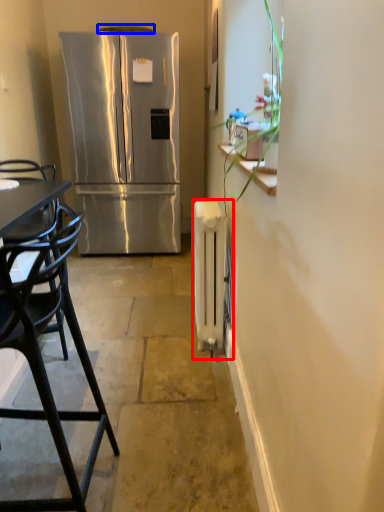
Question: Which of the following is the farthest to the observer, radiator (highlighted by a red box) or exhaust hood (highlighted by a blue box)?

Choices:
 (A) radiator
 (B) exhaust hood

Answer: (B)